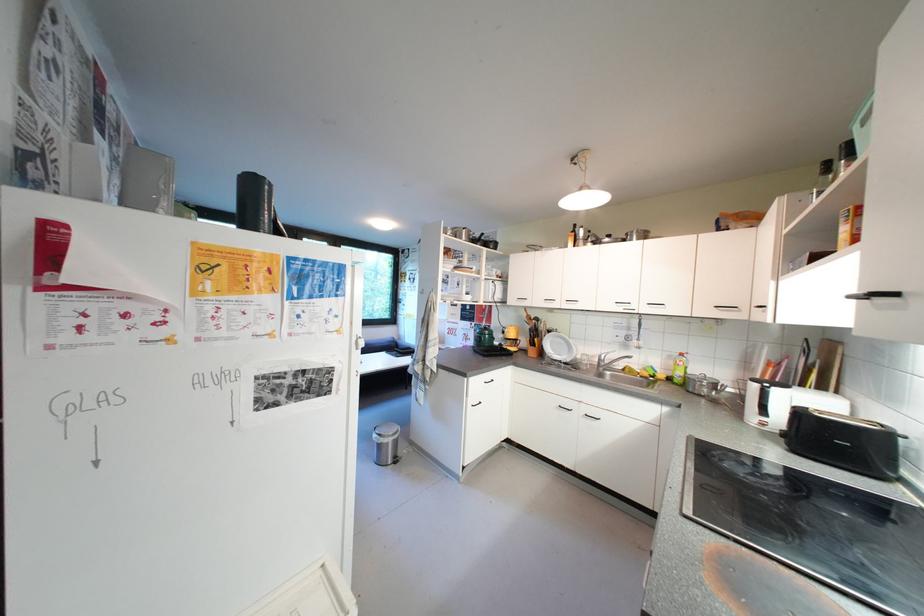
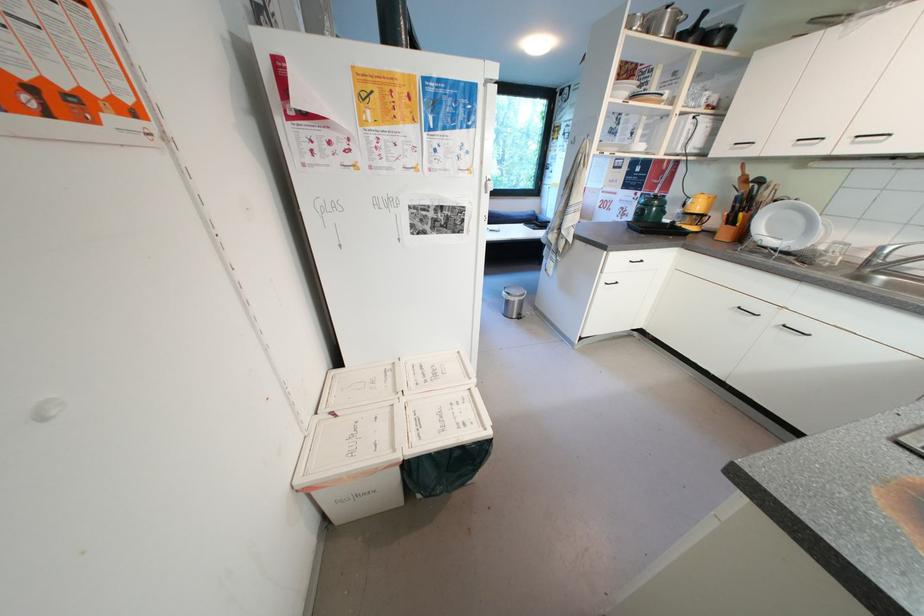
In the second image, find the point that corresponds to pixel 550 355 in the first image.

(749, 238)